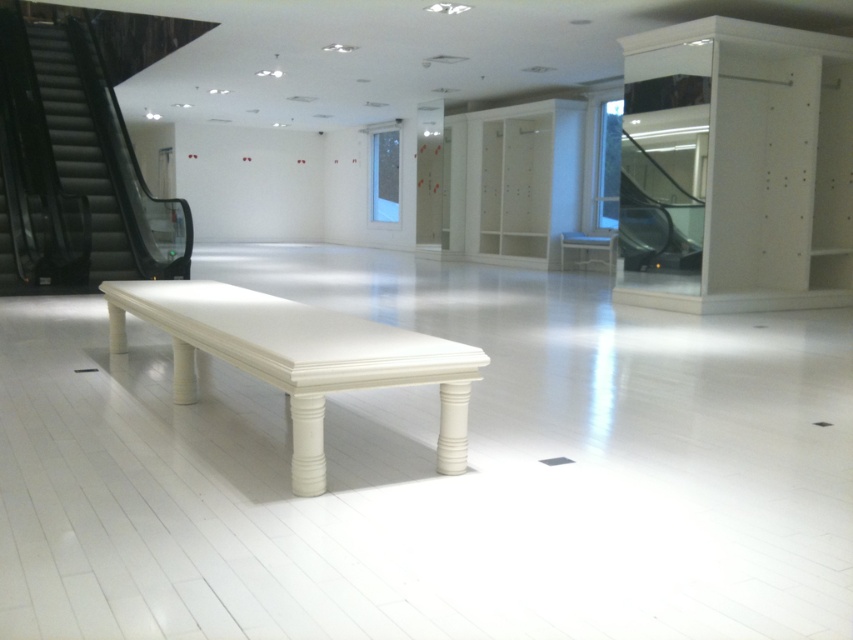
Does white glossy bench at center lie behind metallic glass escalator at right?

No, white glossy bench at center is closer to the viewer.

Can you confirm if white glossy bench at center is taller than metallic glass escalator at right?

In fact, white glossy bench at center may be shorter than metallic glass escalator at right.

I want to click on white glossy bench at center, so click(299, 356).

Is black glass escalator at left shorter than white glossy stool at center?

Yes, black glass escalator at left is shorter than white glossy stool at center.

Describe the element at coordinates (74, 168) in the screenshot. I see `black glass escalator at left` at that location.

This screenshot has width=853, height=640. Identify the location of black glass escalator at left. (74, 168).

Which is below, white glossy bench at center or white glossy stool at center?

white glossy bench at center is lower down.

Who is higher up, white glossy bench at center or white glossy stool at center?

white glossy stool at center

Is point (241, 342) more distant than point (566, 237)?

No, it is not.

This screenshot has width=853, height=640. I want to click on white glossy bench at center, so click(299, 356).